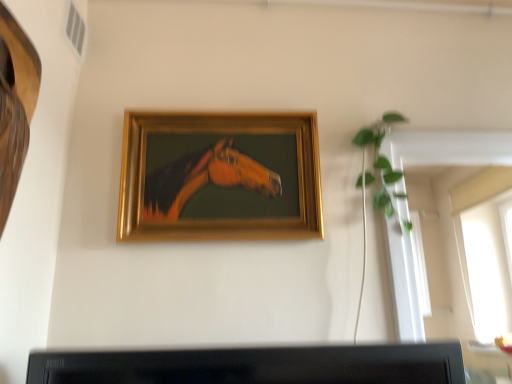
The height and width of the screenshot is (384, 512). What do you see at coordinates (219, 177) in the screenshot?
I see `gold wooden picture frame at center` at bounding box center [219, 177].

The width and height of the screenshot is (512, 384). I want to click on gold wooden picture frame at center, so click(219, 177).

What is the approximate width of green leafy plant at upper right?

green leafy plant at upper right is 2.53 inches wide.

Where is `green leafy plant at upper right`? green leafy plant at upper right is located at coordinates (382, 166).

This screenshot has height=384, width=512. What do you see at coordinates (382, 166) in the screenshot?
I see `green leafy plant at upper right` at bounding box center [382, 166].

You are a GUI agent. You are given a task and a screenshot of the screen. Output one action in this format:
    pyautogui.click(x=<x>, y=<y>)
    Task: Click on the gold wooden picture frame at center
    
    Given the screenshot: What is the action you would take?
    pyautogui.click(x=219, y=177)

Is green leafy plant at upper right to the left of gold wooden picture frame at center from the viewer's perspective?

In fact, green leafy plant at upper right is to the right of gold wooden picture frame at center.

Is the depth of green leafy plant at upper right greater than that of gold wooden picture frame at center?

Yes, it is.

Does point (375, 129) lie behind point (314, 155)?

Yes, point (375, 129) is behind point (314, 155).

From the image's perspective, is green leafy plant at upper right on top of gold wooden picture frame at center?

Correct, green leafy plant at upper right appears higher than gold wooden picture frame at center in the image.

From a real-world perspective, which is physically below, green leafy plant at upper right or gold wooden picture frame at center?

gold wooden picture frame at center is physically lower.

Looking at their sizes, would you say green leafy plant at upper right is wider or thinner than gold wooden picture frame at center?

green leafy plant at upper right is thinner than gold wooden picture frame at center.

Is green leafy plant at upper right taller than gold wooden picture frame at center?

No, green leafy plant at upper right is not taller than gold wooden picture frame at center.

Considering the sizes of objects green leafy plant at upper right and gold wooden picture frame at center in the image provided, who is smaller, green leafy plant at upper right or gold wooden picture frame at center?

With smaller size is green leafy plant at upper right.

Is gold wooden picture frame at center completely or partially inside green leafy plant at upper right?

No, gold wooden picture frame at center is not inside green leafy plant at upper right.

Is green leafy plant at upper right next to gold wooden picture frame at center?

No.

Is green leafy plant at upper right oriented towards gold wooden picture frame at center?

No, green leafy plant at upper right is not oriented towards gold wooden picture frame at center.

Looking at this image, how different are the orientations of green leafy plant at upper right and gold wooden picture frame at center in degrees?

The facing directions of green leafy plant at upper right and gold wooden picture frame at center are 0.0122 degrees apart.

How distant is green leafy plant at upper right from gold wooden picture frame at center?

A distance of 16.93 inches exists between green leafy plant at upper right and gold wooden picture frame at center.

This screenshot has width=512, height=384. Identify the location of picture frame in front of the green leafy plant at upper right. click(x=219, y=177).

Considering the relative positions of gold wooden picture frame at center and green leafy plant at upper right in the image provided, is gold wooden picture frame at center to the right of green leafy plant at upper right from the viewer's perspective?

No.

Is the position of gold wooden picture frame at center less distant than that of green leafy plant at upper right?

Yes, gold wooden picture frame at center is in front of green leafy plant at upper right.

Considering the positions of point (142, 208) and point (386, 163), is point (142, 208) closer or farther from the camera than point (386, 163)?

Point (142, 208) appears to be closer to the viewer than point (386, 163).

From the image's perspective, between gold wooden picture frame at center and green leafy plant at upper right, which one is located above?

green leafy plant at upper right.

From a real-world perspective, is gold wooden picture frame at center on top of green leafy plant at upper right?

No, from a real-world perspective, gold wooden picture frame at center is not above green leafy plant at upper right.

Which object is thinner, gold wooden picture frame at center or green leafy plant at upper right?

With smaller width is green leafy plant at upper right.

Who is taller, gold wooden picture frame at center or green leafy plant at upper right?

gold wooden picture frame at center is taller.

Who is smaller, gold wooden picture frame at center or green leafy plant at upper right?

green leafy plant at upper right.

Does gold wooden picture frame at center contain green leafy plant at upper right?

No, green leafy plant at upper right is not a part of gold wooden picture frame at center.

Is gold wooden picture frame at center positioned far away from green leafy plant at upper right?

No, gold wooden picture frame at center is not far away from green leafy plant at upper right.

Is gold wooden picture frame at center positioned with its back to green leafy plant at upper right?

No, gold wooden picture frame at center's orientation is not away from green leafy plant at upper right.

Find the location of a particular element. picture frame located in front of the green leafy plant at upper right is located at coordinates (219, 177).

Find the location of `picture frame in front of the green leafy plant at upper right`. picture frame in front of the green leafy plant at upper right is located at coordinates [219, 177].

The height and width of the screenshot is (384, 512). Find the location of `plant that appears above the gold wooden picture frame at center (from the image's perspective)`. plant that appears above the gold wooden picture frame at center (from the image's perspective) is located at coordinates (382, 166).